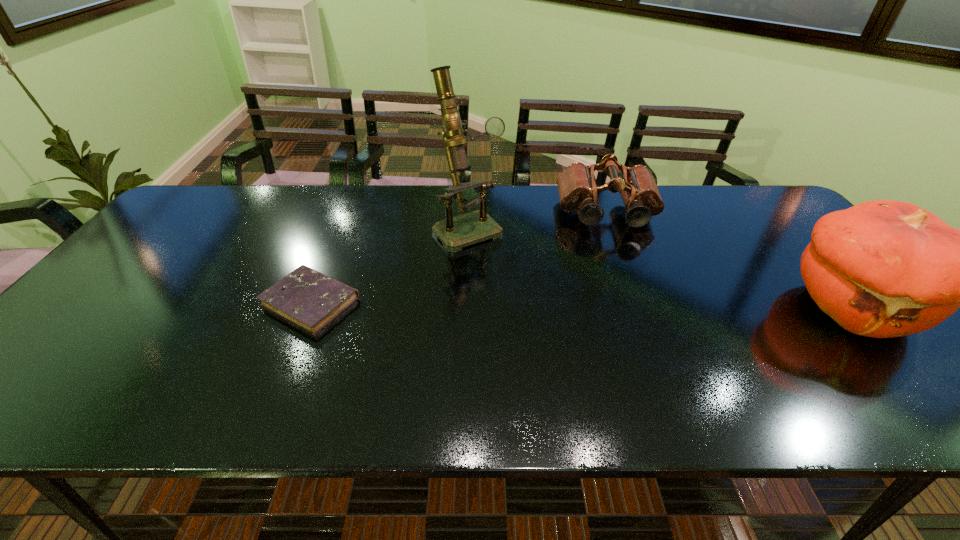
The image size is (960, 540). What are the coordinates of `the leftmost object` in the screenshot? It's located at (310, 300).

This screenshot has width=960, height=540. Find the location of `the shortest object`. the shortest object is located at coordinates (310, 300).

The width and height of the screenshot is (960, 540). I want to click on the third object from right to left, so click(457, 232).

Where is `the tallest object`? the tallest object is located at coordinates (457, 232).

Find the location of a particular element. The height and width of the screenshot is (540, 960). the second object from right to left is located at coordinates (577, 189).

Find the location of a particular element. The height and width of the screenshot is (540, 960). binoculars is located at coordinates (577, 189).

Locate an element on the screen. free space located 0.160m on the left of the leftmost object is located at coordinates (198, 301).

Locate an element on the screen. The height and width of the screenshot is (540, 960). vacant region located 0.170m at the eyepiece of the tallest object is located at coordinates (516, 284).

Where is `free spot located at the eyepiece of the tallest object`? free spot located at the eyepiece of the tallest object is located at coordinates (538, 308).

You are a GUI agent. You are given a task and a screenshot of the screen. Output one action in this format:
    pyautogui.click(x=<x>, y=<y>)
    Task: Click on the vacant space located 0.260m at the eyepiece of the tallest object
    The height and width of the screenshot is (540, 960).
    Given the screenshot: What is the action you would take?
    pyautogui.click(x=535, y=305)